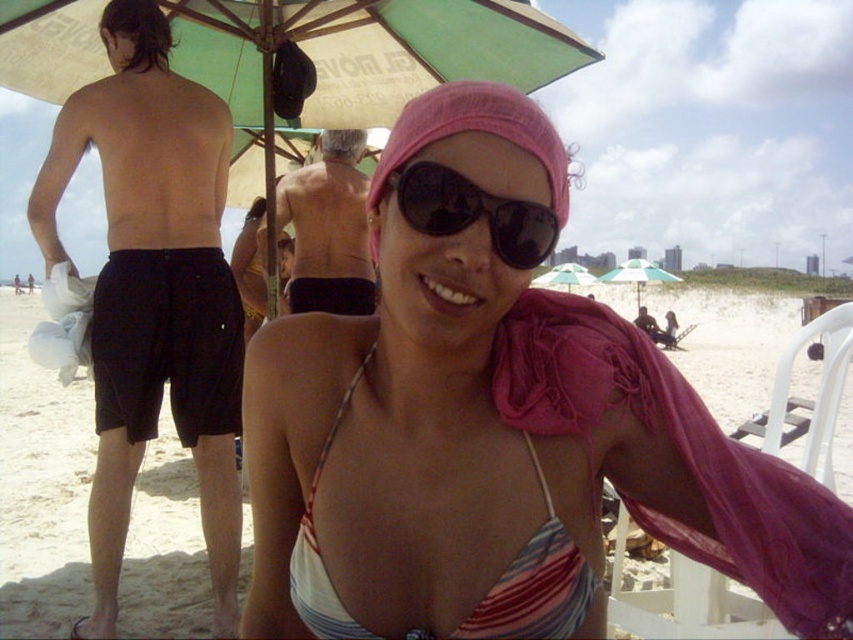
Question: Which point is closer to the camera?

Choices:
 (A) (403, 129)
 (B) (576, 577)

Answer: (A)

Question: Does white plastic beach chair at lower right appear on the left side of black reflective sunglasses at center?

Choices:
 (A) yes
 (B) no

Answer: (B)

Question: Where is smooth tan skin at center located in relation to black reflective sunglasses at center in the image?

Choices:
 (A) above
 (B) below

Answer: (A)

Question: Estimate the real-world distances between objects in this image. Which object is farther from the white plastic beach chair at lower right?

Choices:
 (A) pink fabric bikini top at center
 (B) green fabric umbrella at center
 (C) striped fabric bikini top at center
 (D) black reflective sunglasses at center

Answer: (B)

Question: Which object is farther from the camera taking this photo?

Choices:
 (A) pink fabric headscarf at center
 (B) pink fabric bikini top at center
 (C) black cotton shorts at left

Answer: (C)

Question: Is black cotton shorts at left positioned behind striped fabric bikini top at center?

Choices:
 (A) no
 (B) yes

Answer: (B)